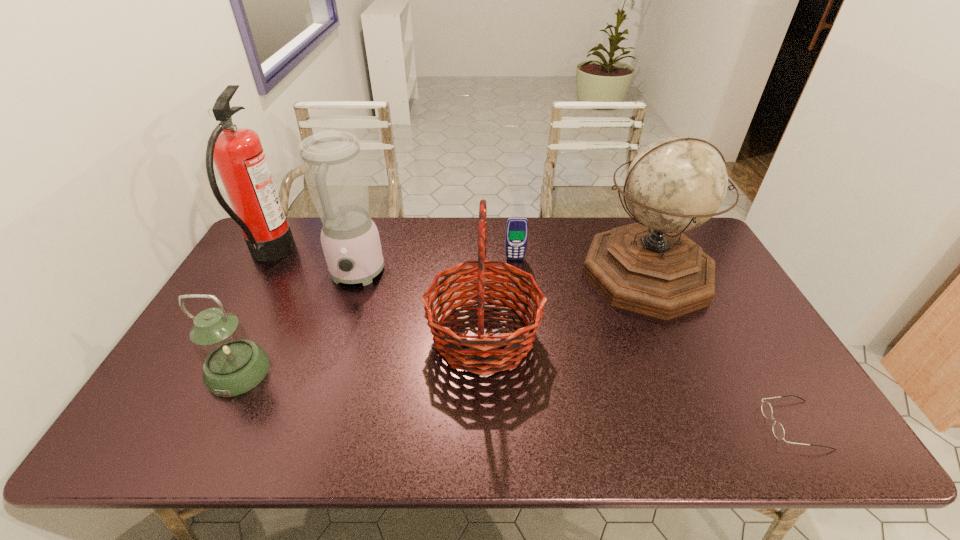
This screenshot has width=960, height=540. In order to click on fire extinguisher in this screenshot , I will do point(237,153).

In order to click on globe in this screenshot , I will do `click(675, 184)`.

At what (x,y) coordinates should I click in order to perform the action: click on food processor. Please return your answer as a coordinate pair (x, y). Looking at the image, I should click on (332, 162).

Find the location of a particular element. This screenshot has width=960, height=540. basket is located at coordinates (483, 356).

The image size is (960, 540). Find the location of `the fifth tallest object`. the fifth tallest object is located at coordinates (233, 364).

You are a GUI agent. You are given a task and a screenshot of the screen. Output one action in this format:
    pyautogui.click(x=<x>, y=<y>)
    Task: Click on the cellular telephone
    This screenshot has height=540, width=960.
    Given the screenshot: What is the action you would take?
    pyautogui.click(x=517, y=227)

In order to click on the shortest object in this screenshot , I will do `click(778, 430)`.

Where is `the nearest object`? This screenshot has height=540, width=960. the nearest object is located at coordinates (778, 430).

Identify the location of vacant space located on the front-facing side of the fire extinguisher. The width and height of the screenshot is (960, 540). (315, 255).

I want to click on free space located on the surface of the globe, so click(x=686, y=366).